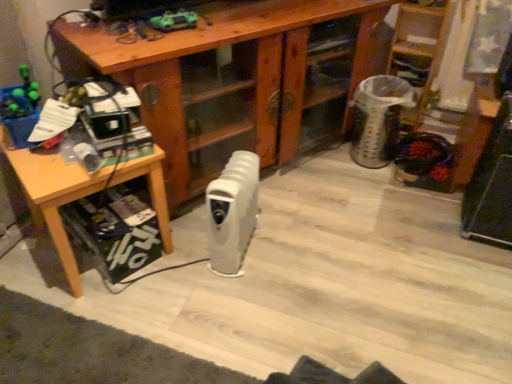
This screenshot has height=384, width=512. What are the coordinates of `wooden table at left` in the screenshot? It's located at (53, 195).

This screenshot has width=512, height=384. Describe the element at coordinates (232, 213) in the screenshot. I see `white plastic radiator at center` at that location.

What do you see at coordinates (227, 84) in the screenshot? The width and height of the screenshot is (512, 384). I see `wooden desk at center` at bounding box center [227, 84].

The width and height of the screenshot is (512, 384). Identify the location of wooden table at left. (53, 195).

How different are the orientations of wooden ladder at upper right and wooden table at left in degrees?

The angular difference between wooden ladder at upper right and wooden table at left is 58.3 degrees.

The image size is (512, 384). Identify the location of shelf that appears above the wooden table at left (from the image's perspective). (420, 44).

Could you tell me if wooden ladder at upper right is facing wooden table at left?

A: No, wooden ladder at upper right is not turned towards wooden table at left.

Is wooden ladder at upper right bigger than wooden table at left?

Actually, wooden ladder at upper right might be smaller than wooden table at left.

In the image, there is a wooden ladder at upper right. Identify the location of table below it (from the image's perspective). This screenshot has height=384, width=512. (53, 195).

Is wooden table at left not near wooden ladder at upper right?

Yes, wooden table at left is far from wooden ladder at upper right.

Can we say wooden table at left lies outside wooden ladder at upper right?

Yes, wooden table at left is outside of wooden ladder at upper right.

Who is smaller, wooden table at left or wooden ladder at upper right?

wooden ladder at upper right.

Which object is closer to the camera taking this photo, white plastic radiator at center or wooden ladder at upper right?

white plastic radiator at center is in front.

From a real-world perspective, is white plastic radiator at center physically located above or below wooden ladder at upper right?

white plastic radiator at center is situated lower than wooden ladder at upper right in the real world.

Visually, is white plastic radiator at center positioned to the left or to the right of wooden ladder at upper right?

Based on their positions, white plastic radiator at center is located to the left of wooden ladder at upper right.

Which of these two, wooden desk at center or wooden table at left, stands taller?

wooden desk at center is taller.

Considering the relative positions of wooden desk at center and wooden table at left in the image provided, is wooden desk at center in front of wooden table at left?

No.

Consider the image. From a real-world perspective, relative to wooden table at left, is wooden desk at center vertically above or below?

wooden desk at center is situated higher than wooden table at left in the real world.

Can you tell me how much wooden desk at center and white plastic radiator at center differ in facing direction?

wooden desk at center and white plastic radiator at center are facing 36.5 degrees away from each other.

Are wooden desk at center and white plastic radiator at center beside each other?

They are not placed beside each other.

From the picture: Is wooden desk at center positioned with its back to white plastic radiator at center?

No, white plastic radiator at center is not at the back of wooden desk at center.

Does point (111, 50) lie in front of point (253, 229)?

Yes, point (111, 50) is in front of point (253, 229).

Is white plastic radiator at center not within wooden table at left?

Yes, white plastic radiator at center is not within wooden table at left.

Considering the sizes of objects white plastic radiator at center and wooden table at left in the image provided, who is wider, white plastic radiator at center or wooden table at left?

wooden table at left is wider.

Which is in front, point (233, 179) or point (54, 187)?

Point (54, 187)

Could you tell me if white plastic radiator at center is turned towards wooden table at left?

No, white plastic radiator at center is not oriented towards wooden table at left.

Between white plastic radiator at center and wooden desk at center, which one has smaller size?

With smaller size is white plastic radiator at center.

From a real-world perspective, which is physically below, white plastic radiator at center or wooden desk at center?

white plastic radiator at center, from a real-world perspective.

Which of these two, white plastic radiator at center or wooden desk at center, stands shorter?

white plastic radiator at center is shorter.

Locate an element on the screen. This screenshot has width=512, height=384. shelf that appears above the wooden table at left (from the image's perspective) is located at coordinates pyautogui.click(x=420, y=44).

Where is `table lying below the wooden ladder at upper right (from the image's perspective)`? Image resolution: width=512 pixels, height=384 pixels. table lying below the wooden ladder at upper right (from the image's perspective) is located at coordinates (53, 195).

Estimate the real-world distances between objects in this image. Which object is further from wooden table at left, wooden desk at center or wooden ladder at upper right?

The object further to wooden table at left is wooden ladder at upper right.

From the image, which object appears to be farther from wooden ladder at upper right, wooden desk at center or white plastic radiator at center?

Among the two, white plastic radiator at center is located further to wooden ladder at upper right.

Considering their positions, is white plastic radiator at center positioned further to wooden table at left than wooden desk at center?

Based on the image, wooden desk at center appears to be further to wooden table at left.

Estimate the real-world distances between objects in this image. Which object is further from wooden table at left, wooden ladder at upper right or wooden desk at center?

Among the two, wooden ladder at upper right is located further to wooden table at left.

When comparing their distances from wooden desk at center, does white plastic radiator at center or wooden table at left seem closer?

The object closer to wooden desk at center is white plastic radiator at center.

Looking at the image, which one is located further to wooden table at left, white plastic radiator at center or wooden ladder at upper right?

Among the two, wooden ladder at upper right is located further to wooden table at left.

When comparing their distances from white plastic radiator at center, does wooden ladder at upper right or wooden desk at center seem further?

Based on the image, wooden ladder at upper right appears to be further to white plastic radiator at center.

Based on their spatial positions, is wooden table at left or white plastic radiator at center closer to wooden ladder at upper right?

Among the two, white plastic radiator at center is located nearer to wooden ladder at upper right.

Find the location of `radiator situated between wooden table at left and wooden desk at center from left to right`. radiator situated between wooden table at left and wooden desk at center from left to right is located at coordinates (232, 213).

Find the location of a particular element. The height and width of the screenshot is (384, 512). desk between wooden table at left and wooden ladder at upper right in the horizontal direction is located at coordinates (227, 84).

Where is `radiator between wooden table at left and wooden ladder at upper right`? radiator between wooden table at left and wooden ladder at upper right is located at coordinates (232, 213).

In order to click on desk between white plastic radiator at center and wooden ladder at upper right in this screenshot , I will do `click(227, 84)`.